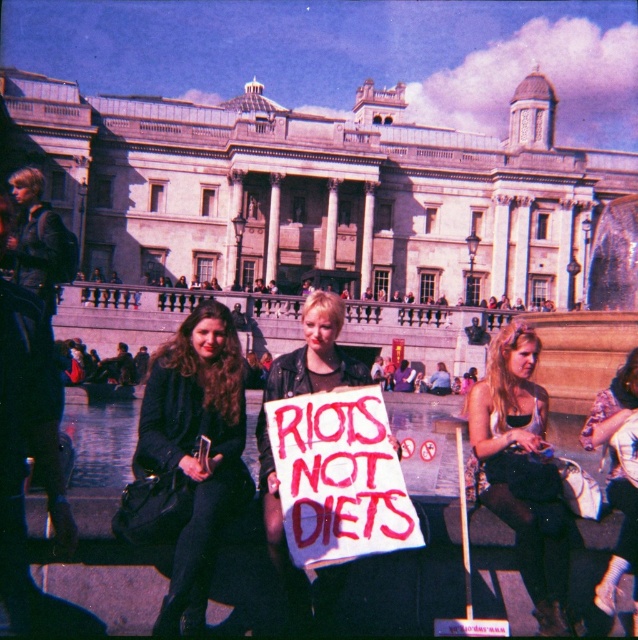
You are a photographer trying to capture a clear shot of both the matte black coat at center and the matte black tank top at center. Since the person wearing the coat is standing, while the one in the tank top is sitting, which clothing item will appear larger in your photo?

The matte black coat at center will appear larger in the photo because it is much taller than the matte black tank top at center.

You are a photographer at the protest scene described. You need to capture a photo that includes both the matte black coat at center and the matte black tank top at center. Since they are both black, you want to ensure their positions are clear in the image. Which object should you place on the left side of the frame to distinguish them?

You should place the matte black coat at center on the left side of the frame because it is to the left of the matte black tank top at center. This arrangement will clearly show their positions relative to each other.

You are a photographer trying to capture both the protestor holding the sign and the grand building in your shot. You notice two points of interest marked at coordinates point (145, 429) and point (614, 582). Which point is closer to you, the photographer?

Point (145, 429) is closer to you than point (614, 582) because it is further to the viewer according to the description.